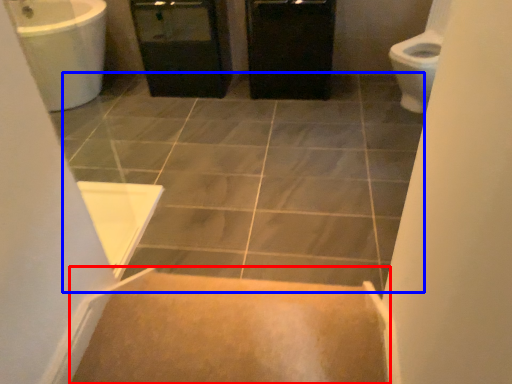
Question: Among these objects, which one is farthest to the camera, stairs (highlighted by a red box) or ceramic tile (highlighted by a blue box)?

Choices:
 (A) stairs
 (B) ceramic tile

Answer: (B)